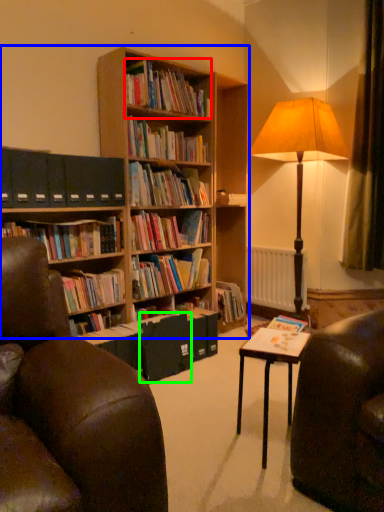
Question: Based on their relative distances, which object is nearer to book (highlighted by a red box)? Choose from bookcase (highlighted by a blue box) and paperback book (highlighted by a green box).

Choices:
 (A) bookcase
 (B) paperback book

Answer: (A)